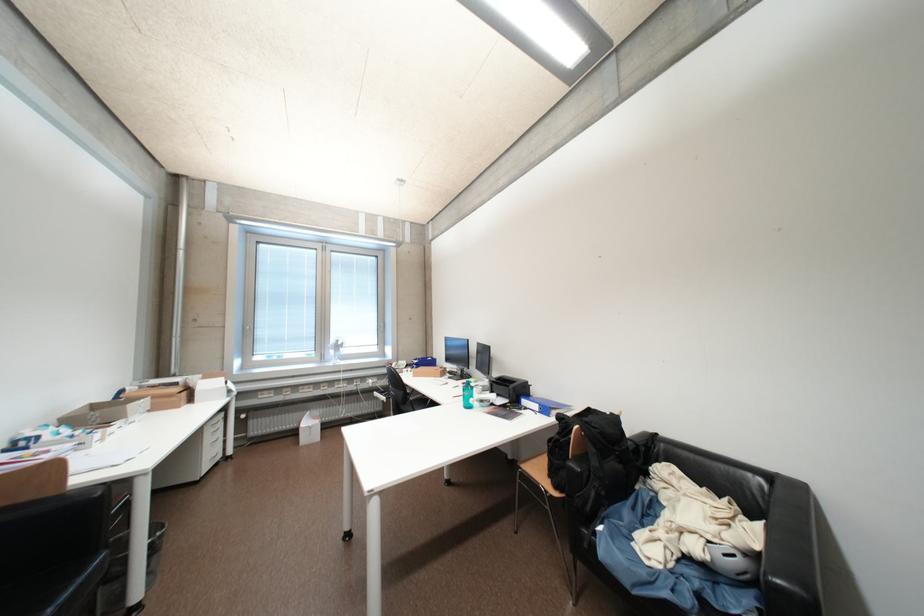
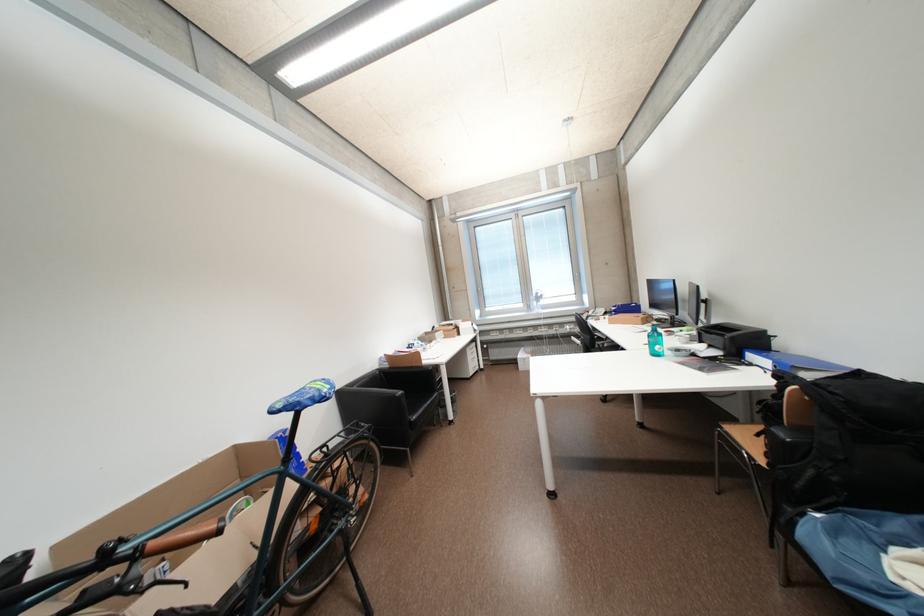
The point at (129,392) is marked in the first image. Where is the corresponding point in the second image?

(442, 330)